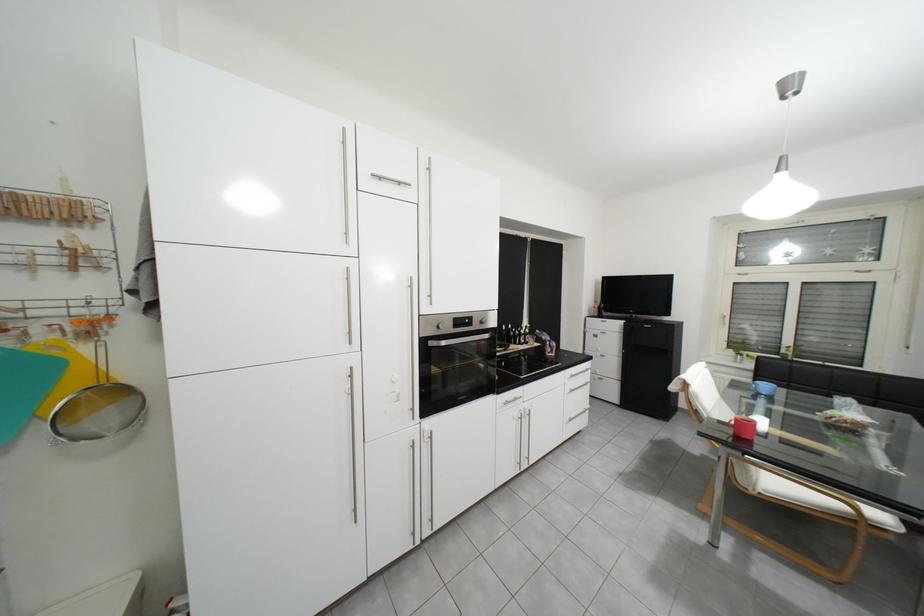
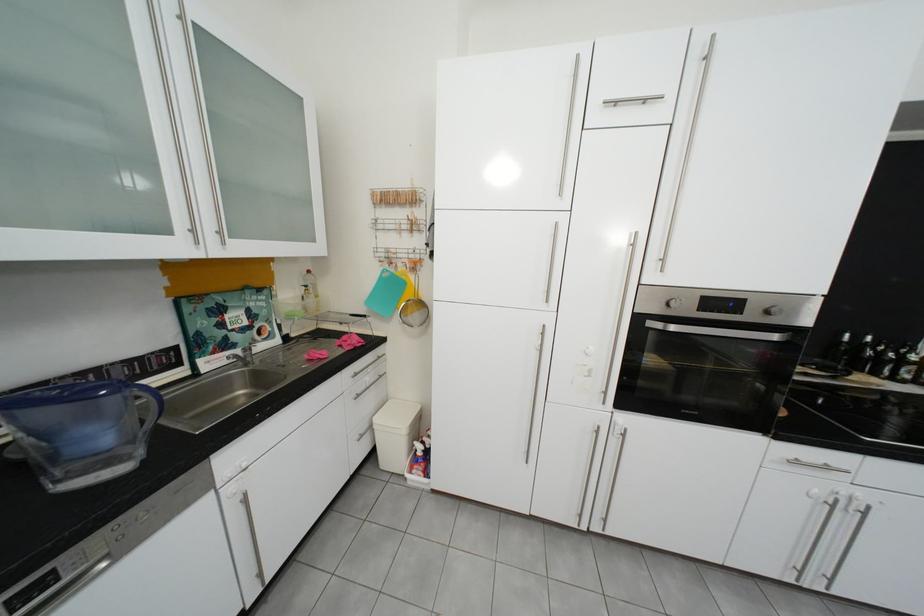
Question: The camera is either moving clockwise (left) or counter-clockwise (right) around the object. The first image is from the beginning of the video and the second image is from the end. Is the camera moving left or right when shooting the video?

Choices:
 (A) Left
 (B) Right

Answer: (B)